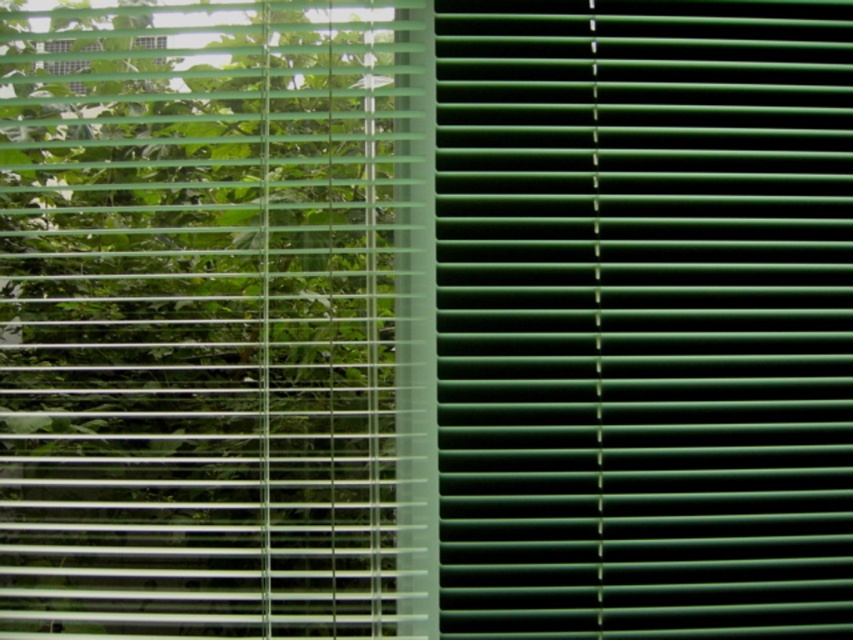
Question: Can you confirm if green plastic blinds at right is bigger than green matte blinds at left?

Choices:
 (A) no
 (B) yes

Answer: (A)

Question: In this image, where is green plastic blinds at right located relative to green matte blinds at left?

Choices:
 (A) left
 (B) right

Answer: (B)

Question: Among these objects, which one is farthest from the camera?

Choices:
 (A) green matte blinds at left
 (B) green plastic blinds at right

Answer: (A)

Question: Which point is closer to the camera?

Choices:
 (A) green plastic blinds at right
 (B) green matte blinds at left

Answer: (A)

Question: Is green plastic blinds at right above green matte blinds at left?

Choices:
 (A) no
 (B) yes

Answer: (B)